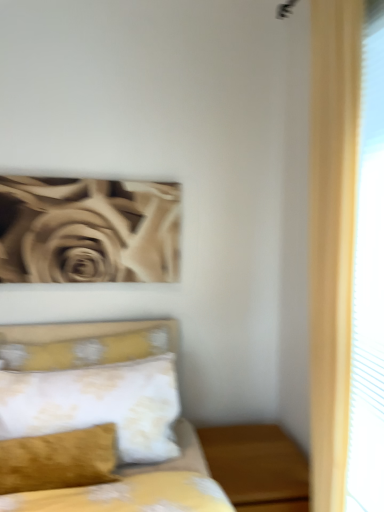
Question: In terms of height, does yellow floral fabric bed at lower left look taller or shorter compared to floral-patterned fabric pillow at center-left?

Choices:
 (A) tall
 (B) short

Answer: (A)

Question: From the image's perspective, is yellow floral fabric bed at lower left located above or below floral-patterned fabric pillow at center-left?

Choices:
 (A) above
 (B) below

Answer: (B)

Question: Estimate the real-world distances between objects in this image. Which object is closer to the yellow floral fabric bed at lower left?

Choices:
 (A) floral-patterned fabric pillow at center-left
 (B) beige textured rose at upper left
 (C) wooden nightstand at lower right

Answer: (A)

Question: Based on their relative distances, which object is farther from the yellow floral fabric bed at lower left?

Choices:
 (A) floral-patterned fabric pillow at center-left
 (B) wooden nightstand at lower right
 (C) beige textured rose at upper left

Answer: (C)